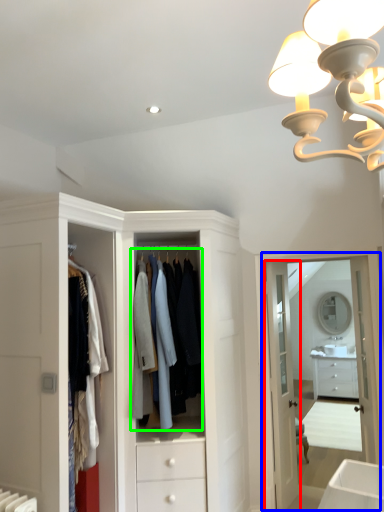
Question: Based on their relative distances, which object is farther from door (highlighted by a red box)? Choose from medicine cabinet (highlighted by a blue box) and clothing (highlighted by a green box).

Choices:
 (A) medicine cabinet
 (B) clothing

Answer: (B)